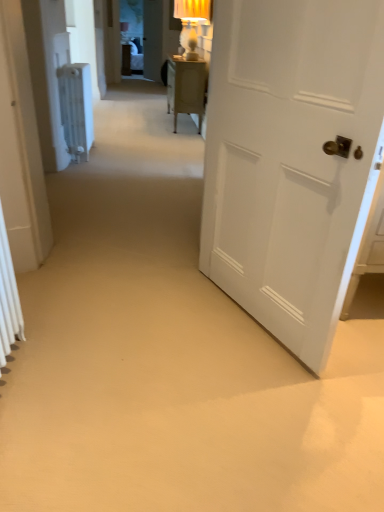
Find the location of a particular element. This screenshot has height=512, width=384. free spot in front of white plastic radiator at left is located at coordinates (99, 163).